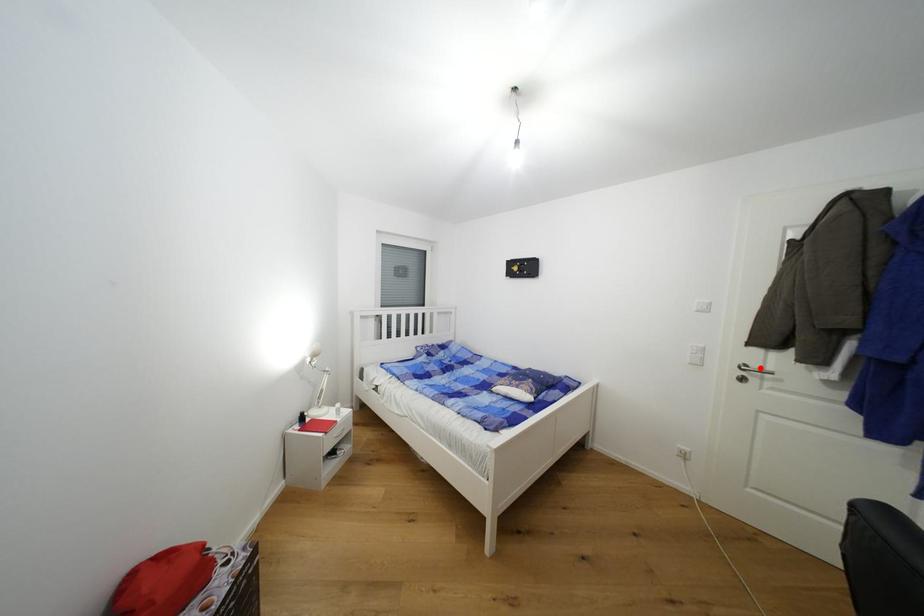
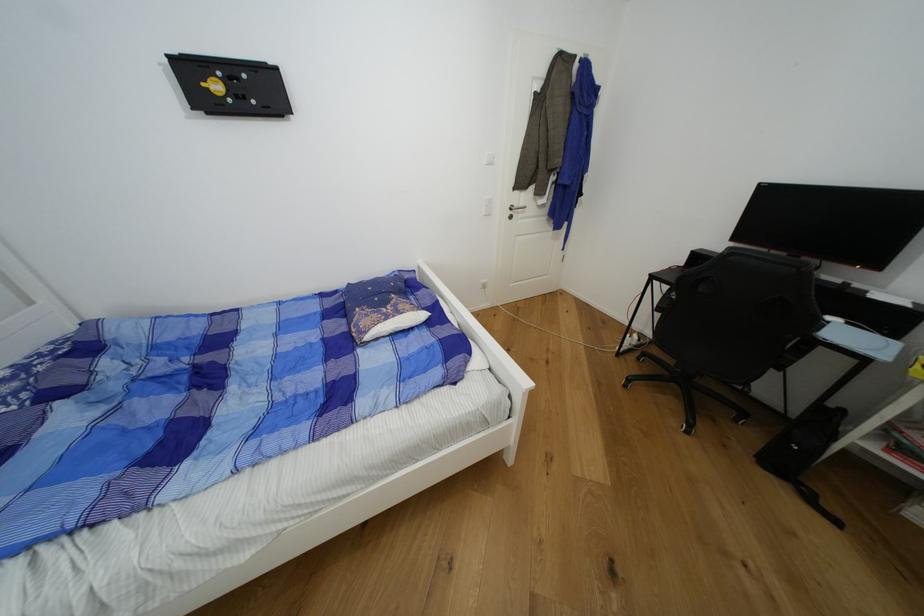
Question: I am providing you with two images of the same scene from different viewpoints. Given a red point in image1, look at the same physical point in image2. Is it:

Choices:
 (A) Closer to the viewpoint
 (B) Farther from the viewpoint

Answer: (A)